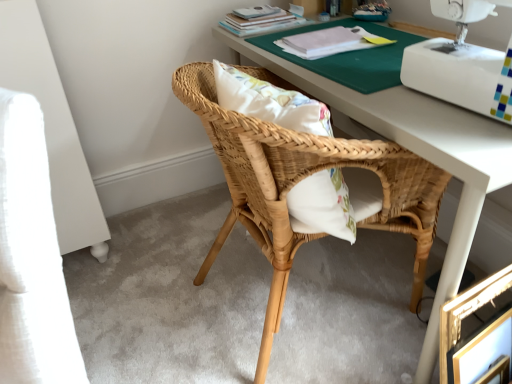
Question: From the image's perspective, is white plastic sewing machine at upper right below natural wood chair at center?

Choices:
 (A) no
 (B) yes

Answer: (A)

Question: Could natural wood chair at center be considered to be inside white plastic sewing machine at upper right?

Choices:
 (A) no
 (B) yes

Answer: (A)

Question: Is white plastic sewing machine at upper right shorter than natural wood chair at center?

Choices:
 (A) yes
 (B) no

Answer: (A)

Question: Is white plastic sewing machine at upper right far from natural wood chair at center?

Choices:
 (A) no
 (B) yes

Answer: (A)

Question: Is white plastic sewing machine at upper right at the left side of natural wood chair at center?

Choices:
 (A) yes
 (B) no

Answer: (B)

Question: Is white plastic sewing machine at upper right inside the boundaries of gold metallic picture frame at lower right, or outside?

Choices:
 (A) outside
 (B) inside

Answer: (A)

Question: Is white plastic sewing machine at upper right taller or shorter than gold metallic picture frame at lower right?

Choices:
 (A) short
 (B) tall

Answer: (A)

Question: From a real-world perspective, relative to gold metallic picture frame at lower right, is white plastic sewing machine at upper right vertically above or below?

Choices:
 (A) below
 (B) above

Answer: (B)

Question: Does point coord(478,107) appear closer or farther from the camera than point coord(459,334)?

Choices:
 (A) farther
 (B) closer

Answer: (B)

Question: From a real-world perspective, is gold metallic picture frame at lower right above or below matte paper book at upper center, the 2th book in the front-to-back sequence?

Choices:
 (A) above
 (B) below

Answer: (B)

Question: From the image's perspective, is gold metallic picture frame at lower right located above or below matte paper book at upper center, the 2th book in the front-to-back sequence?

Choices:
 (A) below
 (B) above

Answer: (A)

Question: Is gold metallic picture frame at lower right situated inside matte paper book at upper center, the 2th book in the front-to-back sequence, or outside?

Choices:
 (A) outside
 (B) inside

Answer: (A)

Question: Is gold metallic picture frame at lower right wider or thinner than matte paper book at upper center, placed as the 1th book when sorted from back to front?

Choices:
 (A) wide
 (B) thin

Answer: (B)

Question: From a real-world perspective, is matte paper book at upper center, the 2th book in the front-to-back sequence, above or below gold metallic picture frame at lower right?

Choices:
 (A) below
 (B) above

Answer: (B)

Question: Is matte paper book at upper center, placed as the 1th book when sorted from back to front, spatially inside gold metallic picture frame at lower right, or outside of it?

Choices:
 (A) inside
 (B) outside

Answer: (B)